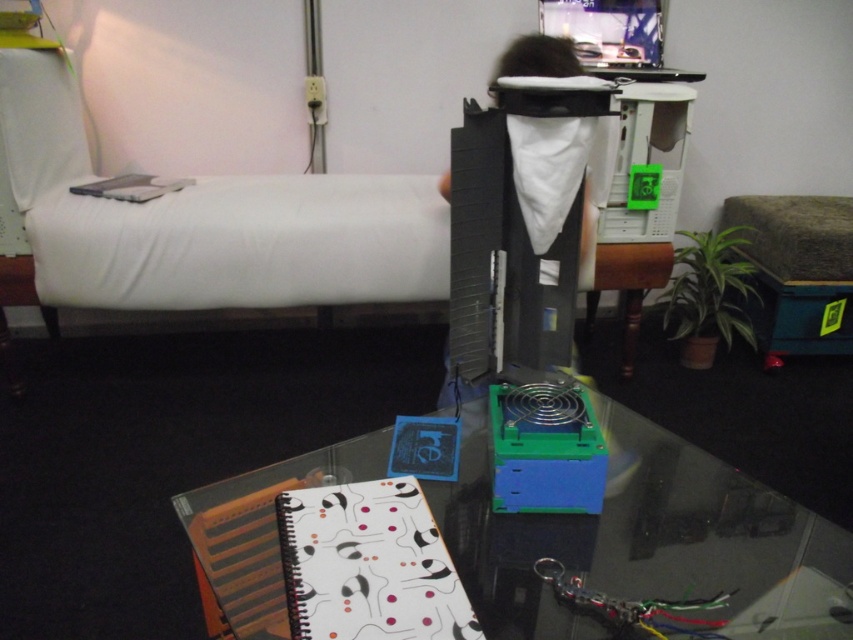
You are standing in the room and see the point marked at coordinates (645, 541). Based on the scene description, where exactly is this point located?

The point is on the transparent glass table at center.

You are standing in the room and want to reach the point at coordinates point (537, 616). If your arm can extend 3 feet, can you reach it without moving?

The distance of point (537, 616) from viewer is 3.30 feet, so no, you cannot reach it with an arm extension of 3 feet as it is further away.

You are standing in the room and want to move from the point at coordinates point (553, 611) to the point at coordinates point (114, 195). Which direction should you move to reach the second point?

To move from point (553, 611) to point (114, 195), you should move towards the lower left direction since point (114, 195) is located to the lower left of point (553, 611).